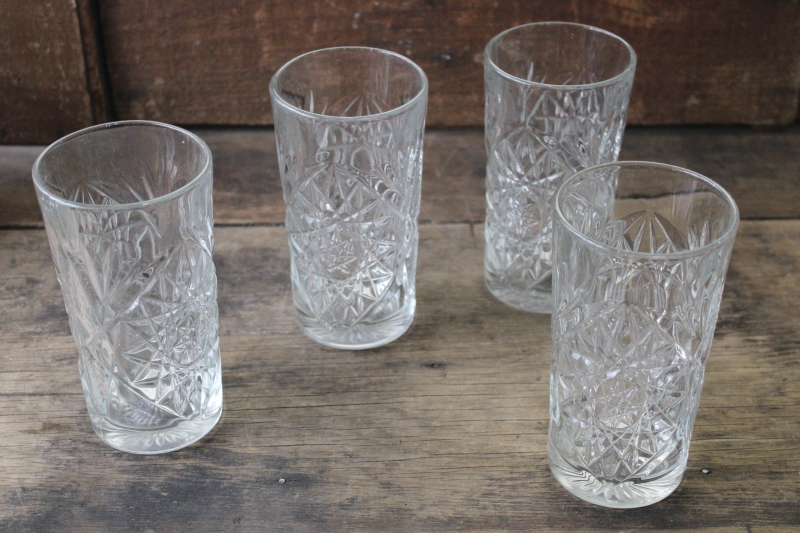
Identify the location of glass. (132, 286), (681, 344), (348, 198), (549, 159).